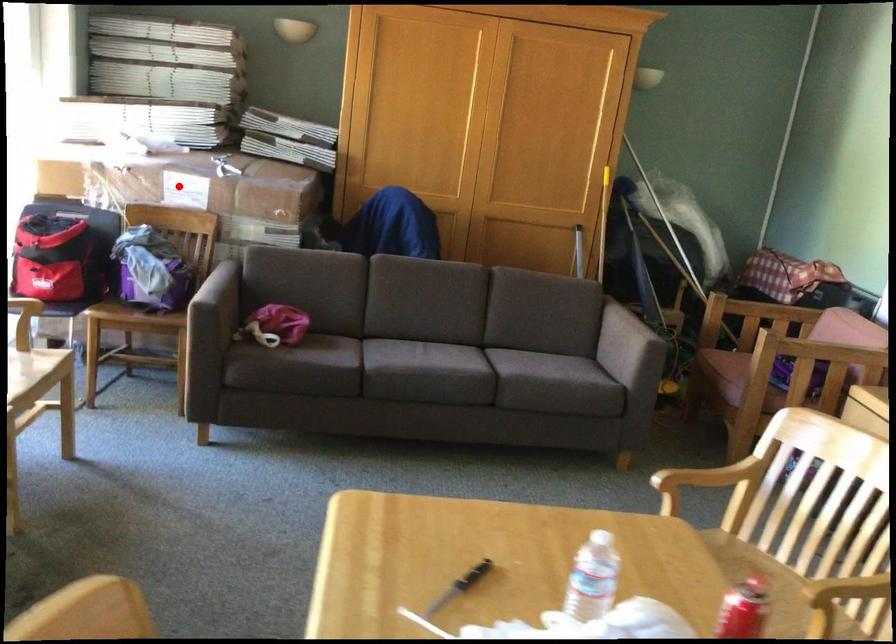
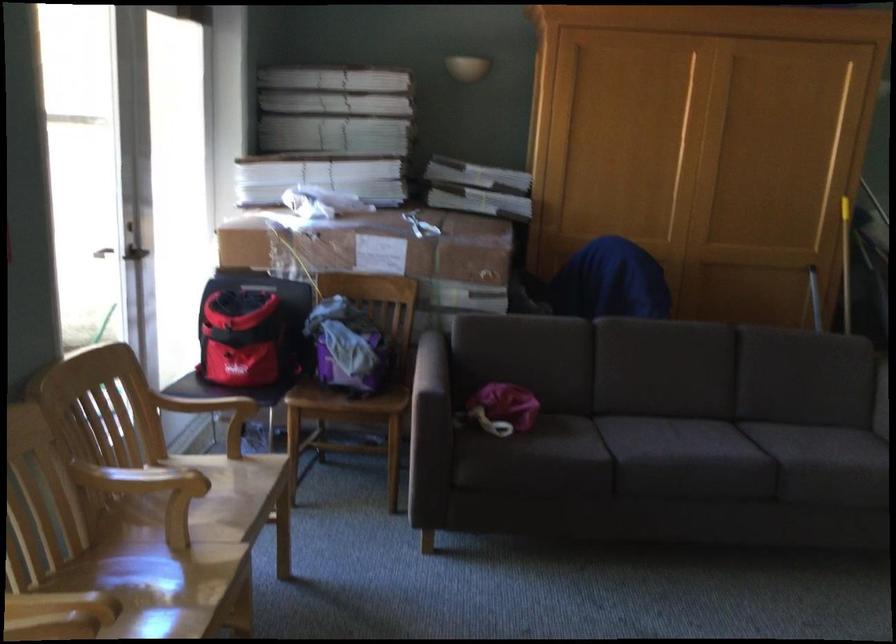
Question: I am providing you with two images of the same scene from different viewpoints. A red point is marked on the first image. At the location where the point appears in image 1, is it still visible in image 2?

Choices:
 (A) Yes
 (B) No

Answer: (A)